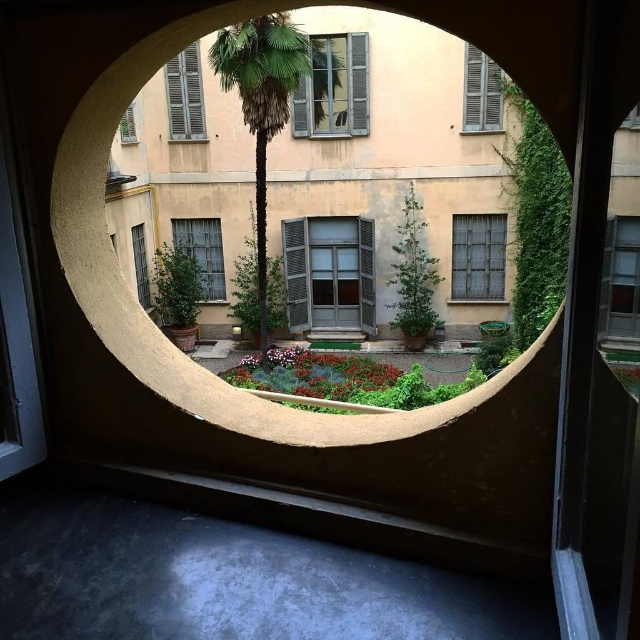
Which is more to the left, smooth beige archway at center or wooden shutters at upper right?

smooth beige archway at center

Does smooth beige archway at center appear over wooden shutters at upper right?

Incorrect, smooth beige archway at center is not positioned above wooden shutters at upper right.

Measure the distance between smooth beige archway at center and camera.

7.72 feet

Identify the location of smooth beige archway at center. This screenshot has height=640, width=640. (136, 301).

Can you confirm if wooden shutters at upper center is thinner than wooden shutters at upper right?

No, wooden shutters at upper center is not thinner than wooden shutters at upper right.

This screenshot has height=640, width=640. What do you see at coordinates (333, 88) in the screenshot? I see `wooden shutters at upper center` at bounding box center [333, 88].

Locate an element on the screen. wooden shutters at upper center is located at coordinates (333, 88).

Is smooth beige archway at center smaller than matte gray window at center-left?

Actually, smooth beige archway at center might be larger than matte gray window at center-left.

Who is lower down, smooth beige archway at center or matte gray window at center-left?

smooth beige archway at center is below.

Measure the distance between smooth beige archway at center and camera.

7.72 feet

The height and width of the screenshot is (640, 640). I want to click on smooth beige archway at center, so click(136, 301).